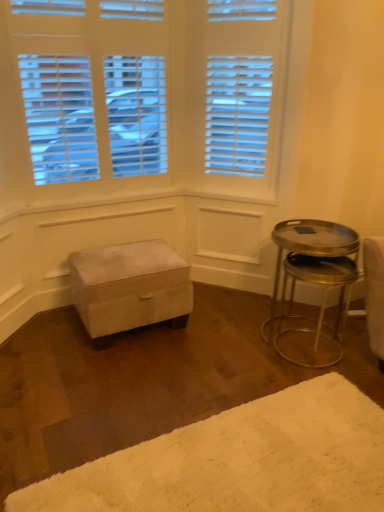
Consider the image. What is the approximate width of white fluffy rug at lower right?

white fluffy rug at lower right is 1.67 meters wide.

What is the approximate width of metallic silver table at right?

metallic silver table at right is 16.84 inches in width.

At what (x,y) coordinates should I click in order to perform the action: click on velvet ottoman at center. Please return your answer as a coordinate pair (x, y). Image resolution: width=384 pixels, height=512 pixels. Looking at the image, I should click on (130, 287).

Is metallic silver table at right inside the boundaries of white fluffy rug at lower right, or outside?

metallic silver table at right exists outside the volume of white fluffy rug at lower right.

Is metallic silver table at right turned away from white fluffy rug at lower right?

metallic silver table at right is not turned away from white fluffy rug at lower right.

From a real-world perspective, who is located higher, metallic silver table at right or white fluffy rug at lower right?

metallic silver table at right, from a real-world perspective.

Between point (353, 268) and point (265, 411), which one is positioned behind?

Positioned behind is point (353, 268).

Which is in front, point (132, 258) or point (330, 362)?

The point (330, 362) is closer to the camera.

From the image's perspective, is velvet ottoman at center located above or below metallic silver table at right?

From the image's perspective, velvet ottoman at center appears above metallic silver table at right.

Would you say velvet ottoman at center is a long distance from metallic silver table at right?

No, velvet ottoman at center is in close proximity to metallic silver table at right.

From the picture: Between velvet ottoman at center and metallic silver table at right, which one has larger width?

With larger width is velvet ottoman at center.

Between metallic silver table at right and velvet ottoman at center, which one has smaller width?

metallic silver table at right.

Is metallic silver table at right located outside velvet ottoman at center?

Absolutely, metallic silver table at right is external to velvet ottoman at center.

Between metallic silver table at right and velvet ottoman at center, which one is positioned in front?

metallic silver table at right.

In the scene shown: From a real-world perspective, is metallic silver table at right physically located above or below velvet ottoman at center?

metallic silver table at right is above velvet ottoman at center.

Can you confirm if white fluffy rug at lower right is positioned to the right of velvet ottoman at center?

Correct, you'll find white fluffy rug at lower right to the right of velvet ottoman at center.

Which object is thinner, white fluffy rug at lower right or velvet ottoman at center?

velvet ottoman at center.

Is point (375, 432) positioned after point (162, 254)?

No, (375, 432) is closer to viewer.

From the image's perspective, which object appears higher, white fluffy rug at lower right or velvet ottoman at center?

From the image's view, velvet ottoman at center is above.

From the image's perspective, which is below, velvet ottoman at center or white fluffy rug at lower right?

white fluffy rug at lower right is shown below in the image.

Is velvet ottoman at center next to white fluffy rug at lower right?

No, velvet ottoman at center is not in contact with white fluffy rug at lower right.

Does point (112, 328) come farther from viewer compared to point (376, 426)?

Yes, point (112, 328) is farther from viewer.

In the scene shown: Who is bigger, velvet ottoman at center or white fluffy rug at lower right?

velvet ottoman at center.

Is white fluffy rug at lower right completely or partially outside of metallic silver table at right?

white fluffy rug at lower right is positioned outside metallic silver table at right.

Is white fluffy rug at lower right directly adjacent to metallic silver table at right?

There is a gap between white fluffy rug at lower right and metallic silver table at right.

In terms of width, does white fluffy rug at lower right look wider or thinner when compared to metallic silver table at right?

Clearly, white fluffy rug at lower right has more width compared to metallic silver table at right.

The height and width of the screenshot is (512, 384). Find the location of `table that is on the right side of white fluffy rug at lower right`. table that is on the right side of white fluffy rug at lower right is located at coordinates tap(312, 285).

In the image, there is a metallic silver table at right. Where is `stool above it (from the image's perspective)`? This screenshot has width=384, height=512. stool above it (from the image's perspective) is located at coordinates (130, 287).

Considering their positions, is velvet ottoman at center positioned closer to white fluffy rug at lower right than metallic silver table at right?

Based on the image, metallic silver table at right appears to be nearer to white fluffy rug at lower right.

When comparing their distances from white fluffy rug at lower right, does metallic silver table at right or velvet ottoman at center seem further?

velvet ottoman at center is further to white fluffy rug at lower right.

Based on the photo, when comparing their distances from metallic silver table at right, does velvet ottoman at center or white fluffy rug at lower right seem further?

The object further to metallic silver table at right is velvet ottoman at center.

Considering their positions, is metallic silver table at right positioned closer to velvet ottoman at center than white fluffy rug at lower right?

metallic silver table at right.

Looking at the image, which one is located further to metallic silver table at right, white fluffy rug at lower right or velvet ottoman at center?

velvet ottoman at center is positioned further to the anchor metallic silver table at right.

Based on the photo, when comparing their distances from velvet ottoman at center, does white fluffy rug at lower right or metallic silver table at right seem closer?

Based on the image, metallic silver table at right appears to be nearer to velvet ottoman at center.

Locate an element on the screen. Image resolution: width=384 pixels, height=512 pixels. table between white fluffy rug at lower right and velvet ottoman at center along the z-axis is located at coordinates (312, 285).